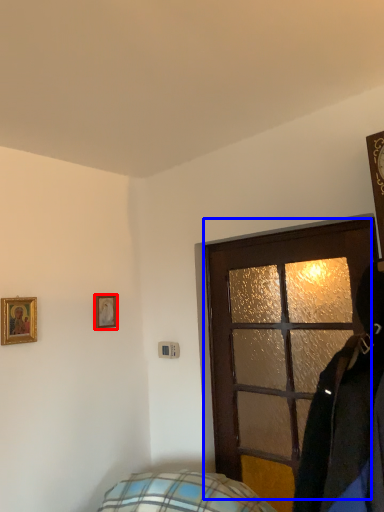
Question: Among these objects, which one is farthest to the camera, picture frame (highlighted by a red box) or door (highlighted by a blue box)?

Choices:
 (A) picture frame
 (B) door

Answer: (A)